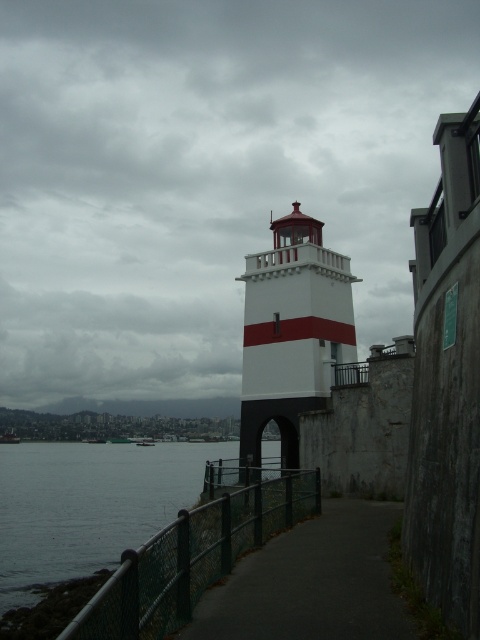
You are standing at the point marked by the coordinates point (291, 332). Looking out towards the water, which direction would you face? The scene includes a white painted concrete lighthouse at center and a green metal fence along the pathway. Please choose from north, south, east, or west.

Since the lighthouse is at the center and the pathway is bordered by a green metal fence near the water, facing towards the water from the lighthouse would mean facing south, as lighthouses typically face outward from land towards water bodies. Therefore, you would be facing south.